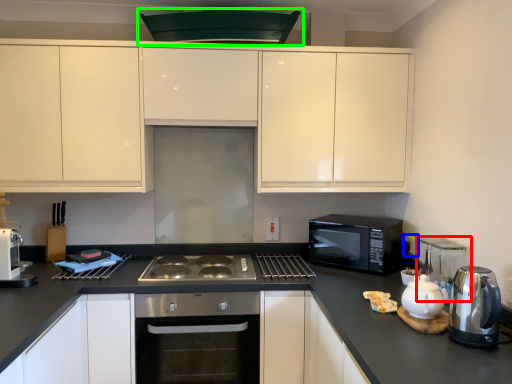
Question: Which object is the farthest from appliance (highlighted by a red box)? Choose among these: electric outlet (highlighted by a blue box) or exhaust hood (highlighted by a green box).

Choices:
 (A) electric outlet
 (B) exhaust hood

Answer: (B)